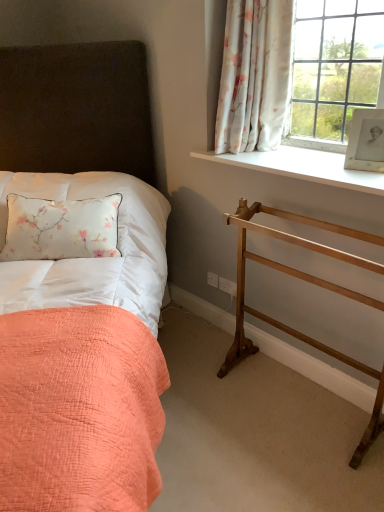
Locate an element on the screen. This screenshot has height=512, width=384. vacant space underneath floral fabric curtain at upper right (from a real-world perspective) is located at coordinates (258, 154).